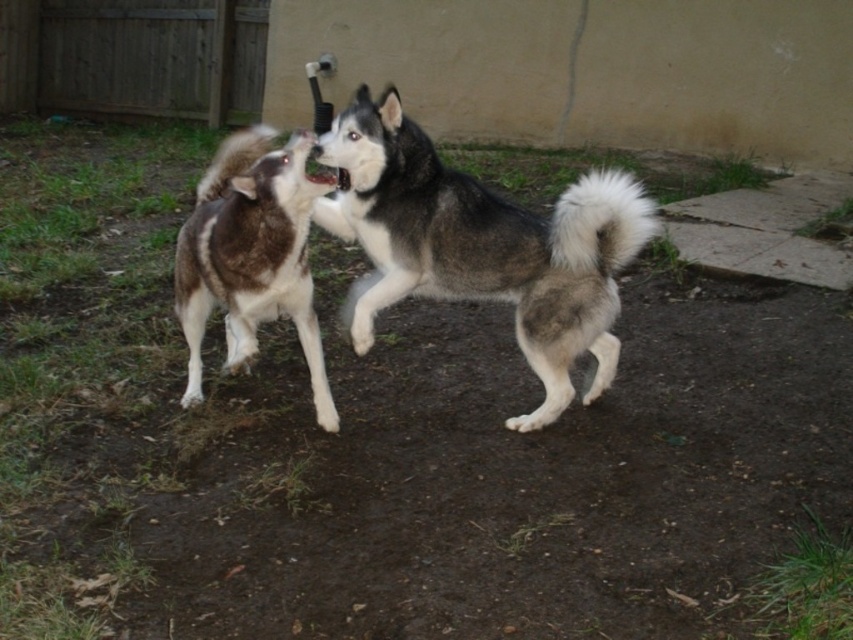
Question: Which point is closer to the camera taking this photo?

Choices:
 (A) (390, 186)
 (B) (279, 262)

Answer: (B)

Question: Which object appears closest to the camera in this image?

Choices:
 (A) gray and white fur dog at center
 (B) brown fur dog at left

Answer: (A)

Question: Can you confirm if gray and white fur dog at center is positioned below brown fur dog at left?

Choices:
 (A) yes
 (B) no

Answer: (B)

Question: Which point is closer to the camera?

Choices:
 (A) (364, 308)
 (B) (196, 371)

Answer: (A)

Question: Is gray and white fur dog at center positioned in front of brown fur dog at left?

Choices:
 (A) yes
 (B) no

Answer: (A)

Question: Can you confirm if gray and white fur dog at center is thinner than brown fur dog at left?

Choices:
 (A) yes
 (B) no

Answer: (B)